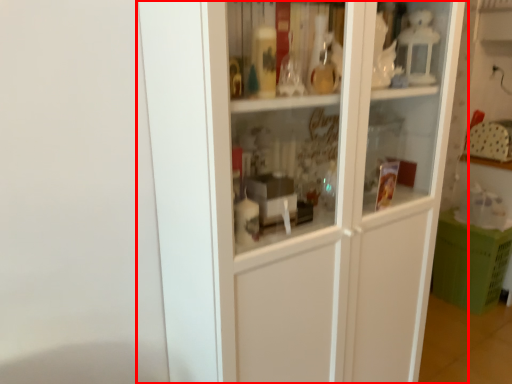
Question: In this image, where is cupboard (annotated by the red box) located relative to cabinetry?

Choices:
 (A) right
 (B) left

Answer: (B)